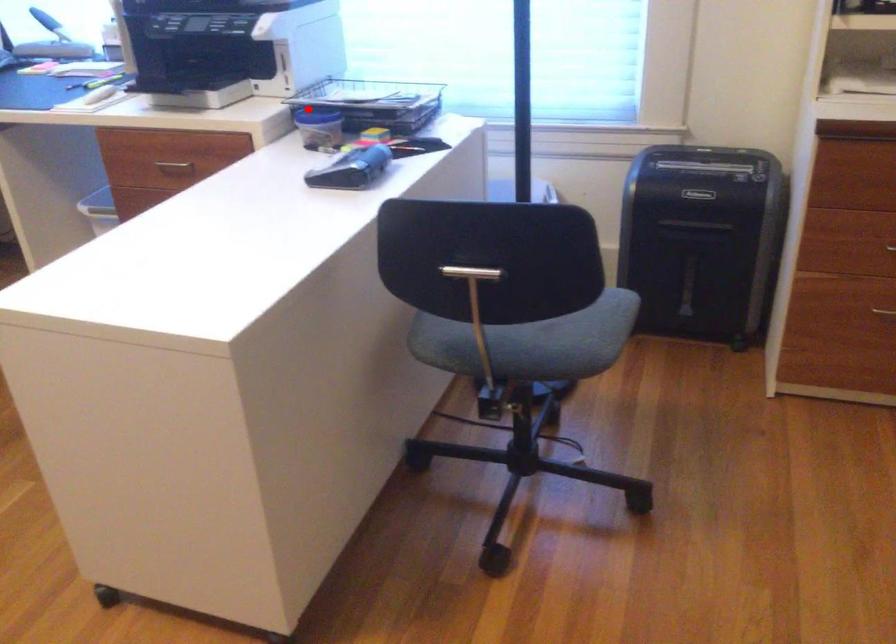
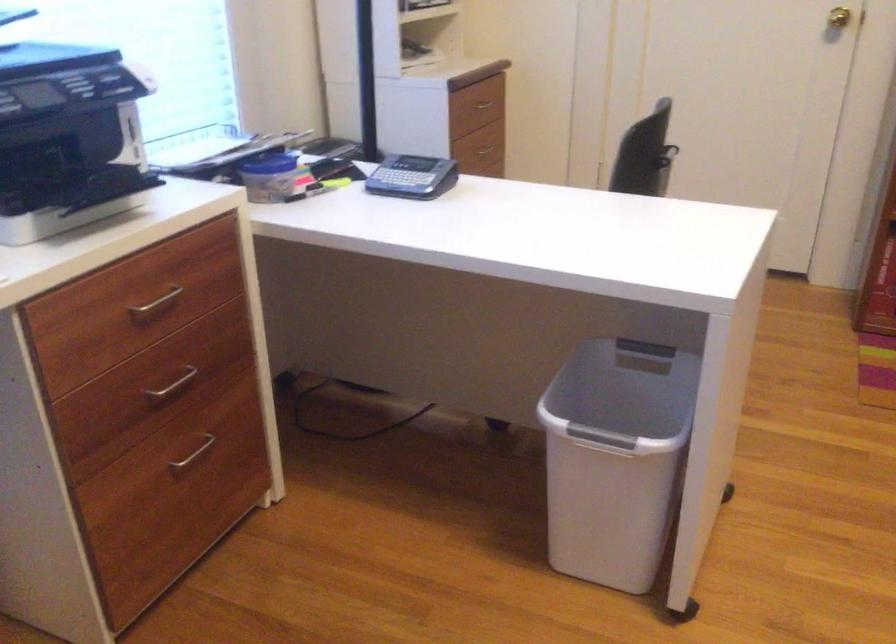
Find the pixel in the second image that matches the highlighted location in the first image.

(270, 164)